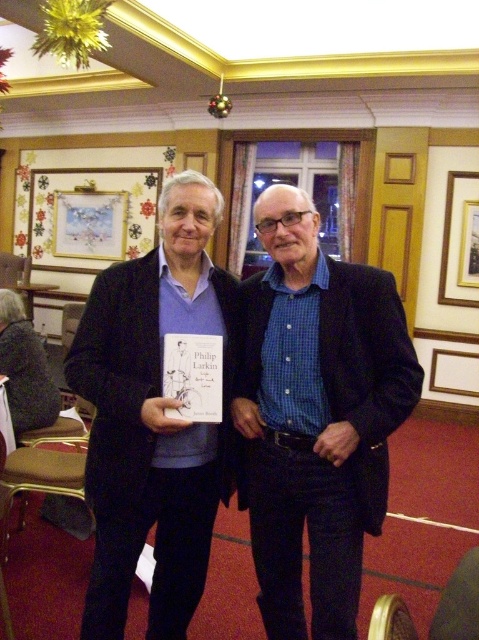
Question: Based on their relative distances, which object is farther from the gold metallic picture frame at upper right?

Choices:
 (A) matte black book at center
 (B) hardcover book at center
 (C) wooden picture frame at upper left

Answer: (B)

Question: Is matte black book at center above wooden picture frame at upper left?

Choices:
 (A) no
 (B) yes

Answer: (A)

Question: Which of these objects is positioned closest to the matte black book at center?

Choices:
 (A) hardcover book at center
 (B) gold metallic picture frame at upper right
 (C) wooden picture frame at upper left

Answer: (A)

Question: Can you confirm if matte black book at center is bigger than wooden picture frame at upper left?

Choices:
 (A) yes
 (B) no

Answer: (B)

Question: Among these points, which one is farthest from the camera?

Choices:
 (A) (179, 362)
 (B) (101, 404)
 (C) (34, 180)

Answer: (C)

Question: Is matte black book at center closer to the viewer compared to hardcover book at center?

Choices:
 (A) yes
 (B) no

Answer: (A)